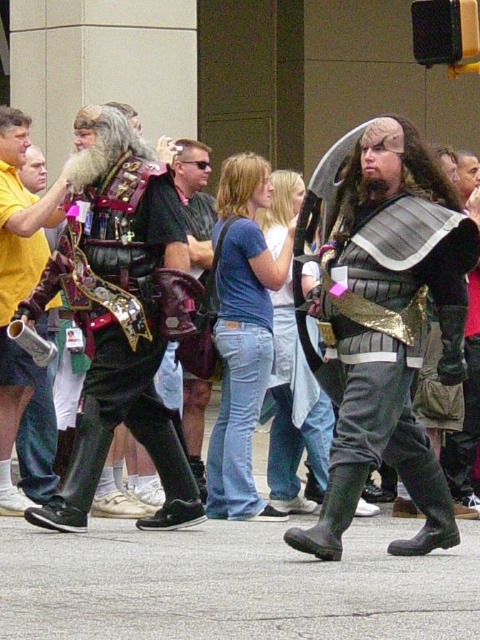
Can you confirm if shiny black armor at center is taller than brushed metal helmet at left?

In fact, shiny black armor at center may be shorter than brushed metal helmet at left.

In order to click on shiny black armor at center in this screenshot , I will do `click(383, 320)`.

Can you confirm if shiny black armor at center is positioned to the right of shiny metallic armor at left?

Indeed, shiny black armor at center is positioned on the right side of shiny metallic armor at left.

Can you confirm if shiny black armor at center is positioned above shiny metallic armor at left?

Yes, shiny black armor at center is above shiny metallic armor at left.

Between point (442, 280) and point (85, 189), which one is positioned behind?

The point (85, 189) is behind.

Locate an element on the screen. The height and width of the screenshot is (640, 480). shiny black armor at center is located at coordinates (383, 320).

Between shiny metallic armor at left and brushed metal helmet at left, which one is positioned lower?

shiny metallic armor at left is below.

Is shiny metallic armor at left positioned before brushed metal helmet at left?

Yes, shiny metallic armor at left is closer to the viewer.

Is point (100, 108) closer to camera compared to point (32, 228)?

No.

At what (x,y) coordinates should I click in order to perform the action: click on shiny metallic armor at left. Please return your answer as a coordinate pair (x, y). This screenshot has width=480, height=640. Looking at the image, I should click on (120, 314).